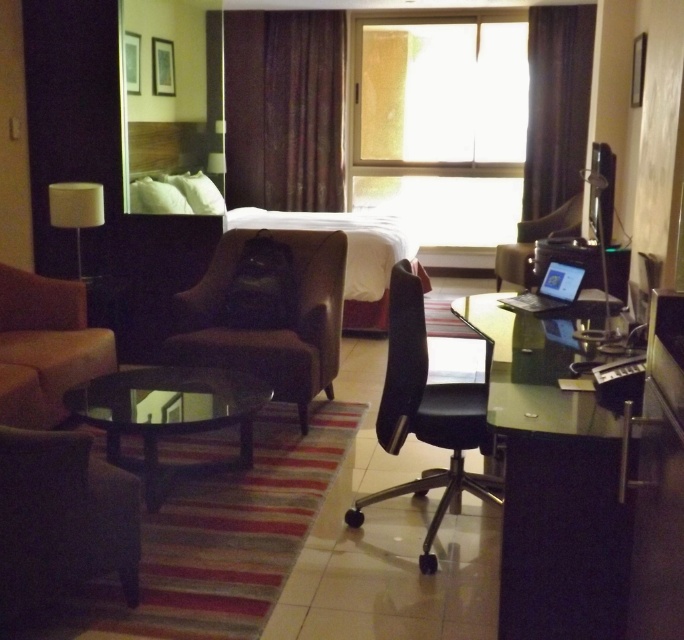
Looking at this image, who is more forward, (8, 589) or (565, 48)?

Point (8, 589) is more forward.

Is point (98, 556) behind point (549, 196)?

No, (98, 556) is in front of (549, 196).

Does point (55, 468) come closer to viewer compared to point (555, 134)?

Yes, point (55, 468) is closer to viewer.

The height and width of the screenshot is (640, 684). In order to click on dark brown leather swivel chair at lower left in this screenshot , I will do `click(62, 518)`.

Is green glass computer desk at right shorter than black leather office chair at center?

Yes.

Which is behind, point (557, 532) or point (473, 429)?

The point (473, 429) is behind.

Identify the location of green glass computer desk at right. (553, 483).

Is dark brown leather swivel chair at lower left bigger than dark brown leather armchair at center?

No.

Who is shorter, dark brown leather swivel chair at lower left or dark brown leather armchair at center?

Standing shorter between the two is dark brown leather swivel chair at lower left.

Is point (57, 548) positioned before point (529, 256)?

Yes, it is.

Identify the location of dark brown leather swivel chair at lower left. Image resolution: width=684 pixels, height=640 pixels. coord(62,518).